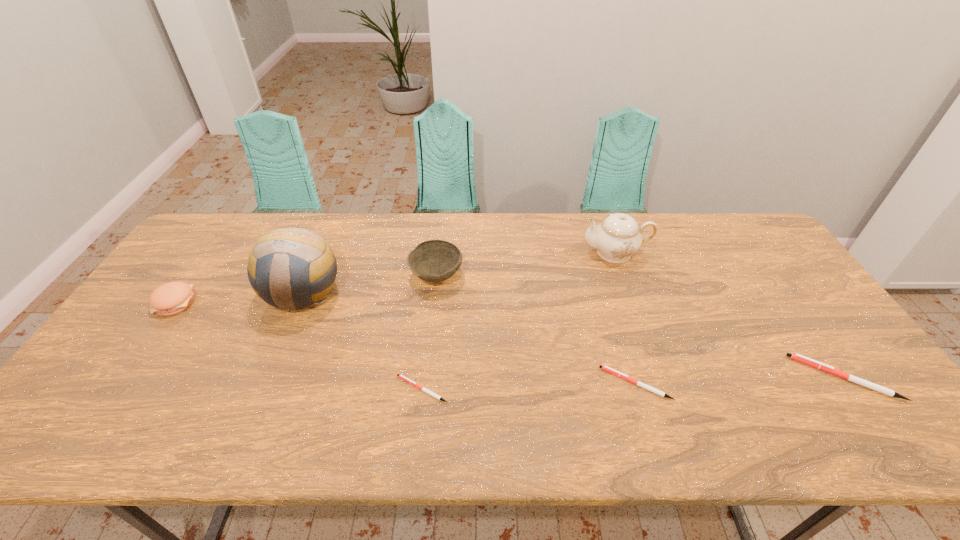
This screenshot has height=540, width=960. I want to click on the shortest pen, so click(x=404, y=378).

Locate an element on the screen. The height and width of the screenshot is (540, 960). the leftmost pen is located at coordinates 404,378.

In order to click on the second shortest pen in this screenshot , I will do `click(608, 369)`.

At what (x,y) coordinates should I click in order to perform the action: click on the second shortest object. Please return your answer as a coordinate pair (x, y). The width and height of the screenshot is (960, 540). Looking at the image, I should click on point(608,369).

You are a GUI agent. You are given a task and a screenshot of the screen. Output one action in this format:
    pyautogui.click(x=<x>, y=<y>)
    Task: Click on the rightmost pen
    This screenshot has width=960, height=540.
    Given the screenshot: What is the action you would take?
    pyautogui.click(x=797, y=357)

Identify the location of the tallest pen. (797, 357).

You are a GUI agent. You are given a task and a screenshot of the screen. Output one action in this format:
    pyautogui.click(x=<x>, y=<y>)
    Task: Click on the chinaware
    
    Given the screenshot: What is the action you would take?
    pyautogui.click(x=618, y=236)

I want to click on volleyball, so click(282, 260).

Identify the location of the tallest object. (282, 260).

Locate an element on the screen. The image size is (960, 540). the fifth shortest object is located at coordinates (434, 260).